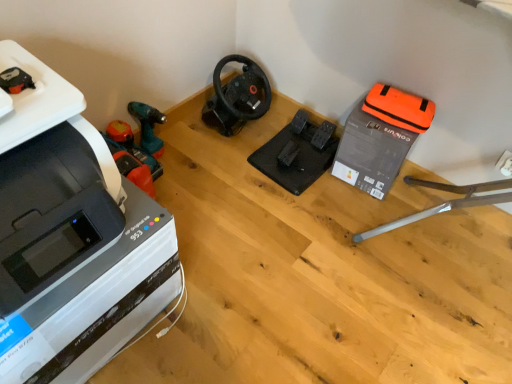
Where is `free location in front of black rubber pedals at center, which is the second equipment in right-to-left order`? free location in front of black rubber pedals at center, which is the second equipment in right-to-left order is located at coordinates (294, 211).